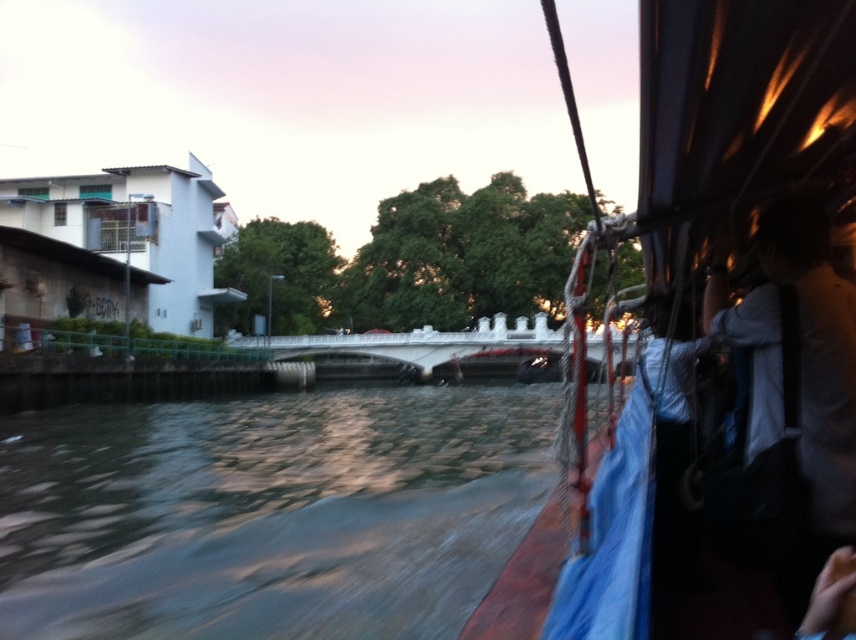
Question: Can you confirm if blue tarpaulin boat at right is positioned to the left of white fabric bag at right?

Choices:
 (A) yes
 (B) no

Answer: (B)

Question: Among these points, which one is farthest from the camera?

Choices:
 (A) (710, 284)
 (B) (706, 72)

Answer: (A)

Question: Considering the relative positions of green stone river at center and blue tarpaulin boat at right in the image provided, where is green stone river at center located with respect to blue tarpaulin boat at right?

Choices:
 (A) above
 (B) below

Answer: (B)

Question: Can you confirm if green stone river at center is positioned below blue tarpaulin boat at right?

Choices:
 (A) no
 (B) yes

Answer: (B)

Question: Estimate the real-world distances between objects in this image. Which object is farther from the white fabric bag at right?

Choices:
 (A) green stone river at center
 (B) blue tarpaulin boat at right

Answer: (A)

Question: Which of the following is the closest to the observer?

Choices:
 (A) green stone river at center
 (B) blue tarpaulin boat at right

Answer: (B)